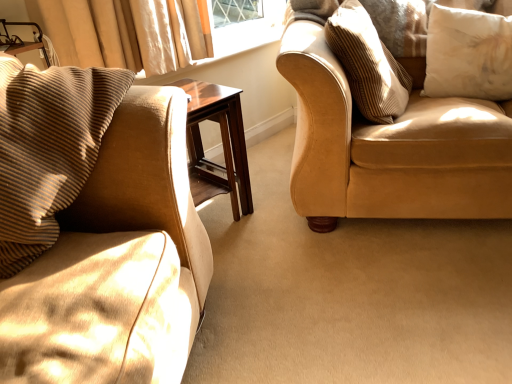
Question: Relative to suede beige couch at right, is white soft cushion at upper right, the first pillow from the right, in front or behind?

Choices:
 (A) front
 (B) behind

Answer: (B)

Question: From the image's perspective, is white soft cushion at upper right, the first pillow from the right, positioned above or below suede beige couch at right?

Choices:
 (A) below
 (B) above

Answer: (B)

Question: Estimate the real-world distances between objects in this image. Which object is farther from the white soft cushion at upper right, the first pillow from the right?

Choices:
 (A) brown corduroy pillow at left, positioned as the third pillow in right-to-left order
 (B) suede beige couch at right
 (C) mahogany wood side table at center
 (D) striped fabric pillow at upper right, acting as the 2th pillow starting from the right

Answer: (A)

Question: Which object is the closest to the white soft cushion at upper right, which ranks as the third pillow in left-to-right order?

Choices:
 (A) striped fabric pillow at upper right, the second pillow viewed from the left
 (B) brown corduroy pillow at left, which is the 1th pillow from left to right
 (C) mahogany wood side table at center
 (D) suede beige couch at right

Answer: (A)